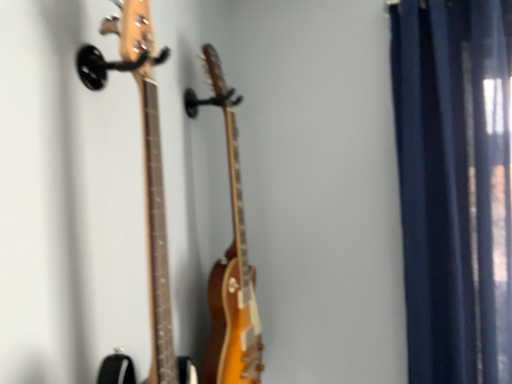
Question: Can you confirm if glossy wood guitar at center, which appears as the 2th guitar when viewed from the front, is wider than natural wood guitar at left, placed as the 1th guitar when sorted from front to back?

Choices:
 (A) no
 (B) yes

Answer: (A)

Question: From a real-world perspective, is glossy wood guitar at center, which appears as the 2th guitar when viewed from the front, positioned over natural wood guitar at left, placed as the 1th guitar when sorted from front to back, based on gravity?

Choices:
 (A) no
 (B) yes

Answer: (A)

Question: From the image's perspective, is glossy wood guitar at center, which appears as the 2th guitar when viewed from the front, beneath natural wood guitar at left, the 2th guitar from the back?

Choices:
 (A) yes
 (B) no

Answer: (A)

Question: From a real-world perspective, is glossy wood guitar at center, which ranks as the 1th guitar in back-to-front order, positioned under natural wood guitar at left, the 2th guitar from the back, based on gravity?

Choices:
 (A) yes
 (B) no

Answer: (A)

Question: Does glossy wood guitar at center, which ranks as the 1th guitar in back-to-front order, have a greater height compared to natural wood guitar at left, placed as the 1th guitar when sorted from front to back?

Choices:
 (A) yes
 (B) no

Answer: (A)

Question: Could you tell me if glossy wood guitar at center, which ranks as the 1th guitar in back-to-front order, is turned towards natural wood guitar at left, the 2th guitar from the back?

Choices:
 (A) no
 (B) yes

Answer: (A)

Question: Considering the relative sizes of natural wood guitar at left, the 2th guitar from the back, and glossy wood guitar at center, which appears as the 2th guitar when viewed from the front, in the image provided, is natural wood guitar at left, the 2th guitar from the back, shorter than glossy wood guitar at center, which appears as the 2th guitar when viewed from the front,?

Choices:
 (A) yes
 (B) no

Answer: (A)

Question: Is natural wood guitar at left, the 2th guitar from the back, thinner than glossy wood guitar at center, which appears as the 2th guitar when viewed from the front?

Choices:
 (A) no
 (B) yes

Answer: (A)

Question: Considering the relative positions of natural wood guitar at left, placed as the 1th guitar when sorted from front to back, and glossy wood guitar at center, which ranks as the 1th guitar in back-to-front order, in the image provided, is natural wood guitar at left, placed as the 1th guitar when sorted from front to back, to the right of glossy wood guitar at center, which ranks as the 1th guitar in back-to-front order, from the viewer's perspective?

Choices:
 (A) no
 (B) yes

Answer: (A)

Question: Is glossy wood guitar at center, which ranks as the 1th guitar in back-to-front order, located within natural wood guitar at left, the 2th guitar from the back?

Choices:
 (A) yes
 (B) no

Answer: (B)

Question: Is natural wood guitar at left, the 2th guitar from the back, smaller than glossy wood guitar at center, which appears as the 2th guitar when viewed from the front?

Choices:
 (A) yes
 (B) no

Answer: (A)

Question: Is natural wood guitar at left, the 2th guitar from the back, beside glossy wood guitar at center, which appears as the 2th guitar when viewed from the front?

Choices:
 (A) no
 (B) yes

Answer: (A)

Question: From a real-world perspective, is dark blue fabric curtain at right located higher than glossy wood guitar at center, which appears as the 2th guitar when viewed from the front?

Choices:
 (A) yes
 (B) no

Answer: (A)